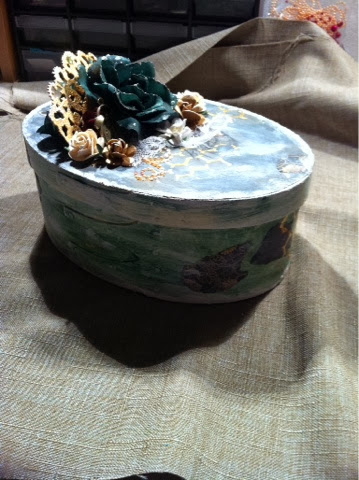
Image resolution: width=359 pixels, height=480 pixels. Find the location of `box lid`. box lid is located at coordinates (199, 209).